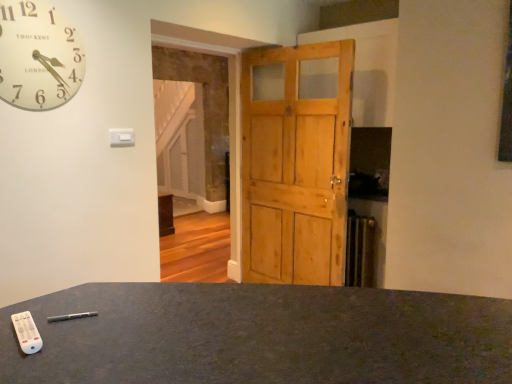
Question: In terms of size, does matte black desk at lower center appear bigger or smaller than white wooden clock at upper left?

Choices:
 (A) small
 (B) big

Answer: (B)

Question: From the image's perspective, is matte black desk at lower center positioned above or below white wooden clock at upper left?

Choices:
 (A) above
 (B) below

Answer: (B)

Question: Estimate the real-world distances between objects in this image. Which object is closer to the white plastic remote at lower left?

Choices:
 (A) matte black desk at lower center
 (B) natural wood barn door at center
 (C) white wooden clock at upper left

Answer: (A)

Question: Estimate the real-world distances between objects in this image. Which object is closer to the white plastic remote at lower left?

Choices:
 (A) matte black desk at lower center
 (B) white wooden clock at upper left
 (C) natural wood barn door at center

Answer: (A)